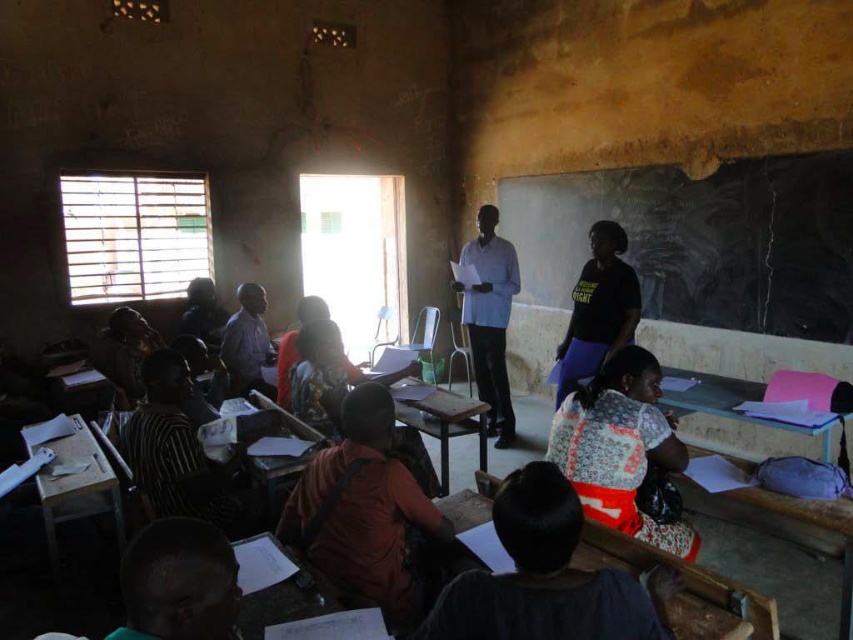
You are standing in the classroom and want to write something on the black chalkboard at upper center. Based on its 2D location coordinates, where should you move to reach it?

The black chalkboard at upper center is located at coordinates 0.377 on the x axis and 0.824 on the y axis, so you should move towards the upper center area of the classroom to reach it.